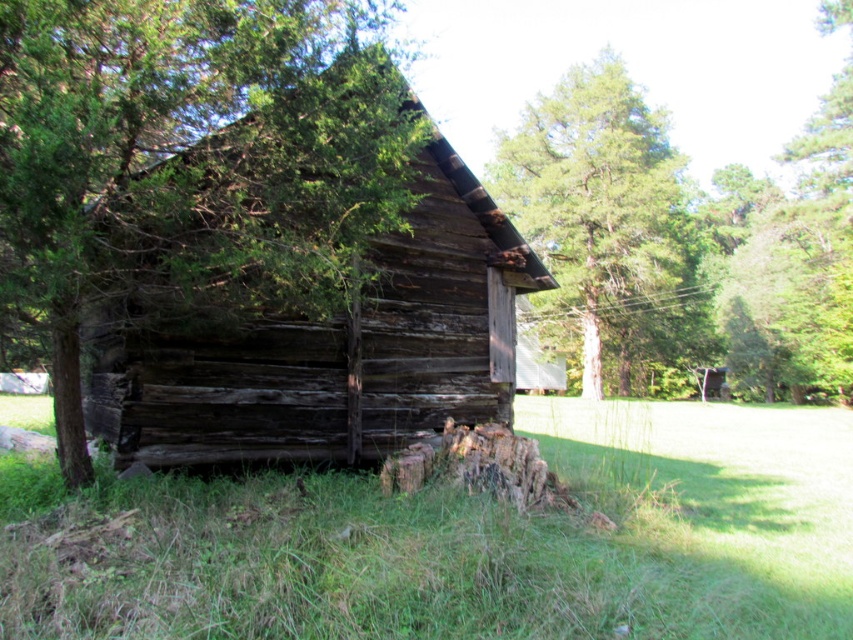
You are standing in front of the rustic wooden cabin and notice the green grass at lower left and the green leafy tree at center. Which object is closer to you from your current position?

The green grass at lower left is positioned under the green leafy tree at center, so the green grass at lower left is closer to you.

You are standing at the entrance of the rustic wooden cabin and see two points marked in the scene. The first point is at coordinate point [335,618] and the second is at point [80,12]. Which point is closer to you?

Point [335,618] is in front of point [80,12], so it is closer to you.